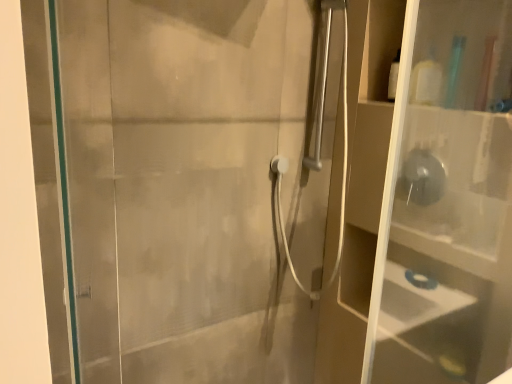
Question: Does transparent plastic shelf at right touch white matte bottle at upper right?

Choices:
 (A) no
 (B) yes

Answer: (A)

Question: Considering the relative sizes of transparent plastic shelf at right and white matte bottle at upper right in the image provided, is transparent plastic shelf at right smaller than white matte bottle at upper right?

Choices:
 (A) yes
 (B) no

Answer: (B)

Question: Are transparent plastic shelf at right and white matte bottle at upper right located far from each other?

Choices:
 (A) no
 (B) yes

Answer: (A)

Question: Is transparent plastic shelf at right further to camera compared to white matte bottle at upper right?

Choices:
 (A) yes
 (B) no

Answer: (B)

Question: Is transparent plastic shelf at right to the left of white matte bottle at upper right from the viewer's perspective?

Choices:
 (A) no
 (B) yes

Answer: (A)

Question: Considering the relative positions of transparent plastic shelf at right and white matte bottle at upper right in the image provided, is transparent plastic shelf at right to the right of white matte bottle at upper right from the viewer's perspective?

Choices:
 (A) no
 (B) yes

Answer: (B)

Question: From a real-world perspective, is white matte bottle at upper right physically above transparent plastic shelf at right?

Choices:
 (A) yes
 (B) no

Answer: (A)

Question: Is white matte bottle at upper right surrounding transparent plastic shelf at right?

Choices:
 (A) no
 (B) yes

Answer: (A)

Question: Can you confirm if white matte bottle at upper right is positioned to the right of transparent plastic shelf at right?

Choices:
 (A) yes
 (B) no

Answer: (B)

Question: Is white matte bottle at upper right directly adjacent to transparent plastic shelf at right?

Choices:
 (A) no
 (B) yes

Answer: (A)

Question: Is white matte bottle at upper right taller than transparent plastic shelf at right?

Choices:
 (A) yes
 (B) no

Answer: (B)

Question: Can you confirm if white matte bottle at upper right is bigger than transparent plastic shelf at right?

Choices:
 (A) no
 (B) yes

Answer: (A)

Question: From a real-world perspective, is transparent glass screen door at left located beneath white matte bottle at upper right?

Choices:
 (A) yes
 (B) no

Answer: (A)